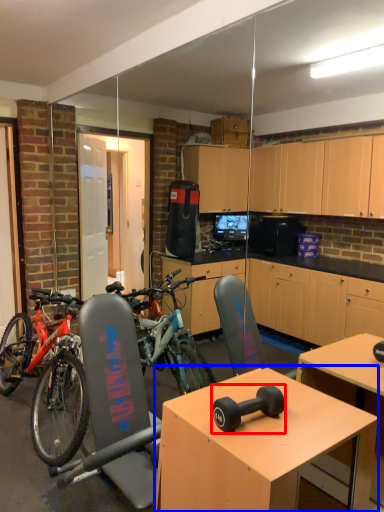
Question: Which point is further to the camera, dumbbell (highlighted by a red box) or desk (highlighted by a blue box)?

Choices:
 (A) dumbbell
 (B) desk

Answer: (A)